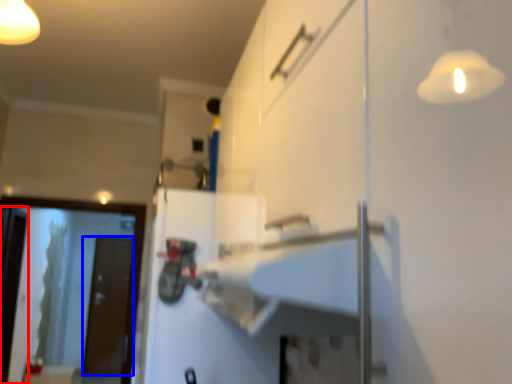
Question: Which of the following is the closest to the observer, screen door (highlighted by a red box) or door (highlighted by a blue box)?

Choices:
 (A) screen door
 (B) door

Answer: (A)